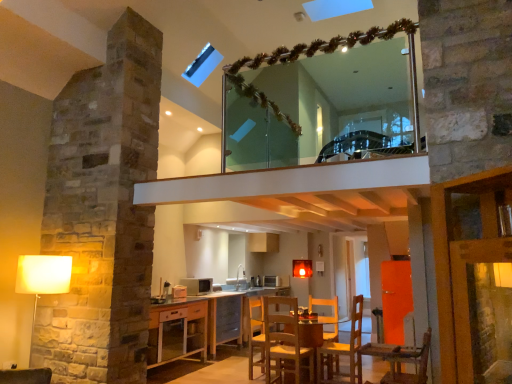
The image size is (512, 384). What do you see at coordinates (197, 285) in the screenshot?
I see `matte silver microwave at center, which appears as the second appliance when ordered from the bottom` at bounding box center [197, 285].

What is the approximate width of matte silver microwave at center, which appears as the second appliance when ordered from the bottom?

14.58 inches.

Describe the element at coordinates (402, 360) in the screenshot. I see `wooden chair at lower right` at that location.

Where is `matte white lampshade at left`? This screenshot has height=384, width=512. matte white lampshade at left is located at coordinates (42, 276).

Where is `wooden chair at lower center`? wooden chair at lower center is located at coordinates (256, 335).

Locate an element on the screen. The width and height of the screenshot is (512, 384). matte silver microwave at center, which is the second appliance in back-to-front order is located at coordinates (197, 285).

From the image's perspective, does clear glass mirror at upper center appear lower than wooden glass table at center?

No.

Is clear glass mirror at upper center taller or shorter than wooden glass table at center?

Clearly, clear glass mirror at upper center is taller compared to wooden glass table at center.

Find the location of `mirror that appears in front of the wooden glass table at center`. mirror that appears in front of the wooden glass table at center is located at coordinates (321, 102).

Consider the image. In the image, is clear glass mirror at upper center on the left side or the right side of wooden glass table at center?

clear glass mirror at upper center is to the left of wooden glass table at center.

Is matte white lampshade at left surrounding metallic silver microwave at center, acting as the 1th appliance starting from the right?

No.

Considering the sizes of objects matte white lampshade at left and metallic silver microwave at center, which ranks as the 1th appliance in back-to-front order, in the image provided, who is smaller, matte white lampshade at left or metallic silver microwave at center, which ranks as the 1th appliance in back-to-front order,?

Smaller between the two is metallic silver microwave at center, which ranks as the 1th appliance in back-to-front order.

Identify the location of appliance that is the 2nd one when counting downward from the matte white lampshade at left (from the image's perspective). (272, 281).

Consider the image. Is metallic silver microwave at center, the second appliance positioned from the front, at the back of matte white lampshade at left?

matte white lampshade at left does not have its back to metallic silver microwave at center, the second appliance positioned from the front.

How much distance is there between metallic silver microwave at center, acting as the 1th appliance starting from the right, and matte silver microwave at center, which is the 1th appliance in left-to-right order?

metallic silver microwave at center, acting as the 1th appliance starting from the right, is 1.33 meters from matte silver microwave at center, which is the 1th appliance in left-to-right order.

Which point is more forward, (266, 280) or (208, 288)?

Point (208, 288)

Where is `appliance located on the left of metallic silver microwave at center, acting as the 1th appliance starting from the right`? The width and height of the screenshot is (512, 384). appliance located on the left of metallic silver microwave at center, acting as the 1th appliance starting from the right is located at coordinates (197, 285).

Which object is more forward, metallic silver microwave at center, placed as the second appliance when sorted from top to bottom, or matte silver microwave at center, the first appliance in the front-to-back sequence?

matte silver microwave at center, the first appliance in the front-to-back sequence, is in front.

Are wooden chair at lower center and matte silver microwave at center, which is the 1th appliance in left-to-right order, far apart?

wooden chair at lower center is positioned a significant distance from matte silver microwave at center, which is the 1th appliance in left-to-right order.

Which of these two, wooden chair at lower center or matte silver microwave at center, the first appliance in the top-to-bottom sequence, stands shorter?

Standing shorter between the two is matte silver microwave at center, the first appliance in the top-to-bottom sequence.

Is wooden chair at lower center bigger than matte silver microwave at center, which is the second appliance in back-to-front order?

Indeed, wooden chair at lower center has a larger size compared to matte silver microwave at center, which is the second appliance in back-to-front order.

Is point (260, 318) closer or farther from the camera than point (206, 278)?

Point (260, 318) appears to be closer to the viewer than point (206, 278).

Based on the photo, considering the relative sizes of wooden glass table at center and wooden chair at lower right in the image provided, is wooden glass table at center shorter than wooden chair at lower right?

In fact, wooden glass table at center may be taller than wooden chair at lower right.

From a real-world perspective, is wooden glass table at center positioned over wooden chair at lower right based on gravity?

No, from a real-world perspective, wooden glass table at center is not over wooden chair at lower right

Do you think wooden glass table at center is within wooden chair at lower right, or outside of it?

wooden glass table at center is not enclosed by wooden chair at lower right.

Is point (326, 319) less distant than point (423, 377)?

That is False.

Considering the sizes of objects wooden chair at lower center and clear glass mirror at upper center in the image provided, who is bigger, wooden chair at lower center or clear glass mirror at upper center?

wooden chair at lower center is bigger.

Is wooden chair at lower center positioned with its back to clear glass mirror at upper center?

wooden chair at lower center does not have its back to clear glass mirror at upper center.

Is wooden chair at lower center to the left of clear glass mirror at upper center from the viewer's perspective?

Yes.

Is the surface of wooden chair at lower center in direct contact with clear glass mirror at upper center?

No.

From the image's perspective, is matte white lampshade at left above wooden chair at lower center?

Yes, from the image's perspective, matte white lampshade at left is over wooden chair at lower center.

Based on the photo, can you confirm if matte white lampshade at left is wider than wooden chair at lower center?

Yes.

Is matte white lampshade at left facing away from wooden chair at lower center?

No, matte white lampshade at left's orientation is not away from wooden chair at lower center.

Based on their sizes in the image, would you say matte white lampshade at left is bigger or smaller than wooden chair at lower center?

matte white lampshade at left is bigger than wooden chair at lower center.

Where is `table to the right of clear glass mirror at upper center`? The width and height of the screenshot is (512, 384). table to the right of clear glass mirror at upper center is located at coordinates (316, 333).

Where is `the 1st appliance positioned above the matte white lampshade at left (from a real-world perspective)`? This screenshot has height=384, width=512. the 1st appliance positioned above the matte white lampshade at left (from a real-world perspective) is located at coordinates (272, 281).

When comparing their distances from wooden chair at lower center, does clear glass mirror at upper center or metallic silver microwave at center, which ranks as the 1th appliance in back-to-front order, seem closer?

The object closer to wooden chair at lower center is metallic silver microwave at center, which ranks as the 1th appliance in back-to-front order.

Considering their positions, is wooden chair at lower center positioned further to clear glass mirror at upper center than metallic silver microwave at center, the second appliance positioned from the front?

metallic silver microwave at center, the second appliance positioned from the front, lies further to clear glass mirror at upper center than the other object.

Estimate the real-world distances between objects in this image. Which object is further from wooden chair at lower center, metallic silver microwave at center, the 1th appliance ordered from the bottom, or matte silver microwave at center, which is the second appliance in back-to-front order?

Based on the image, metallic silver microwave at center, the 1th appliance ordered from the bottom, appears to be further to wooden chair at lower center.

From the image, which object appears to be farther from matte silver microwave at center, arranged as the second appliance when viewed from the right, matte white lampshade at left or wooden chair at lower center?

matte white lampshade at left.

Considering their positions, is wooden chair at lower center positioned closer to wooden chair at lower right than wooden glass table at center?

wooden glass table at center is closer to wooden chair at lower right.

Looking at the image, which one is located closer to wooden chair at lower center, metallic silver microwave at center, the second appliance viewed from the left, or clear glass mirror at upper center?

The object closer to wooden chair at lower center is metallic silver microwave at center, the second appliance viewed from the left.

Looking at the image, which one is located closer to wooden chair at lower right, matte silver microwave at center, the first appliance in the front-to-back sequence, or matte white lampshade at left?

matte white lampshade at left lies closer to wooden chair at lower right than the other object.

Estimate the real-world distances between objects in this image. Which object is closer to wooden chair at lower center, metallic silver microwave at center, which ranks as the 1th appliance in back-to-front order, or wooden chair at lower right?

wooden chair at lower right is closer to wooden chair at lower center.

This screenshot has height=384, width=512. I want to click on appliance positioned between matte white lampshade at left and metallic silver microwave at center, the 1th appliance ordered from the bottom, from near to far, so click(197, 285).

You are a GUI agent. You are given a task and a screenshot of the screen. Output one action in this format:
    pyautogui.click(x=<x>, y=<y>)
    Task: Click on the table between matte white lampshade at left and wooden chair at lower right
    This screenshot has height=384, width=512.
    Given the screenshot: What is the action you would take?
    pyautogui.click(x=316, y=333)

Find the location of `table between clear glass mirror at upper center and metallic silver microwave at center, placed as the second appliance when sorted from top to bottom, from front to back`. table between clear glass mirror at upper center and metallic silver microwave at center, placed as the second appliance when sorted from top to bottom, from front to back is located at coordinates (316, 333).

What are the coordinates of `appliance between clear glass mirror at upper center and metallic silver microwave at center, the second appliance positioned from the front, along the z-axis` in the screenshot? It's located at (197, 285).